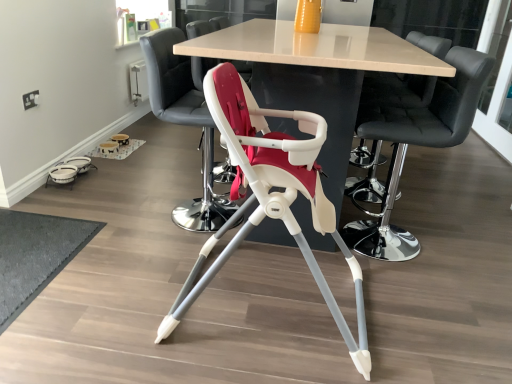
Question: Does smooth black bar stool at center, placed as the first chair when sorted from right to left, lie behind black leather bar stool at upper center, the second chair from the right?

Choices:
 (A) yes
 (B) no

Answer: (A)

Question: Is smooth black bar stool at center, marked as the 4th chair in a left-to-right arrangement, in contact with black leather bar stool at upper center, the second chair from the right?

Choices:
 (A) no
 (B) yes

Answer: (A)

Question: Is smooth black bar stool at center, placed as the first chair when sorted from right to left, at the left side of black leather bar stool at upper center, the second chair from the right?

Choices:
 (A) no
 (B) yes

Answer: (A)

Question: From a real-world perspective, does smooth black bar stool at center, marked as the 4th chair in a left-to-right arrangement, sit lower than black leather bar stool at upper center, which is the third chair from left to right?

Choices:
 (A) no
 (B) yes

Answer: (B)

Question: Could you tell me if smooth black bar stool at center, placed as the first chair when sorted from right to left, is turned towards black leather bar stool at upper center, which is the third chair from left to right?

Choices:
 (A) yes
 (B) no

Answer: (B)

Question: Is smooth black bar stool at center, marked as the 4th chair in a left-to-right arrangement, oriented away from black leather bar stool at upper center, which is the third chair from left to right?

Choices:
 (A) yes
 (B) no

Answer: (B)

Question: Is the depth of matte white highchair at center, acting as the 3th chair starting from the right, greater than that of dark gray textured mat at lower left?

Choices:
 (A) yes
 (B) no

Answer: (B)

Question: Is matte white highchair at center, acting as the 3th chair starting from the right, facing towards dark gray textured mat at lower left?

Choices:
 (A) no
 (B) yes

Answer: (A)

Question: Can you confirm if matte white highchair at center, which appears as the 2th chair when viewed from the left, is positioned to the right of dark gray textured mat at lower left?

Choices:
 (A) yes
 (B) no

Answer: (A)

Question: From a real-world perspective, is matte white highchair at center, acting as the 3th chair starting from the right, physically below dark gray textured mat at lower left?

Choices:
 (A) yes
 (B) no

Answer: (B)

Question: Is matte white highchair at center, which appears as the 2th chair when viewed from the left, to the left of dark gray textured mat at lower left from the viewer's perspective?

Choices:
 (A) no
 (B) yes

Answer: (A)

Question: Considering the relative sizes of matte white highchair at center, acting as the 3th chair starting from the right, and dark gray textured mat at lower left in the image provided, is matte white highchair at center, acting as the 3th chair starting from the right, taller than dark gray textured mat at lower left?

Choices:
 (A) no
 (B) yes

Answer: (B)

Question: From the image's perspective, is dark gray textured mat at lower left above matte white highchair at center, acting as the 3th chair starting from the right?

Choices:
 (A) yes
 (B) no

Answer: (B)